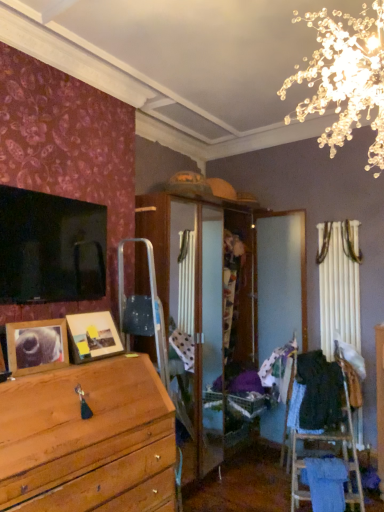
Question: Are patterned fabric at center, positioned as the first clothing in left-to-right order, and wooden picture frame at lower left, the 1th picture frame viewed from the front, making contact?

Choices:
 (A) no
 (B) yes

Answer: (A)

Question: Considering the relative sizes of patterned fabric at center, positioned as the first clothing in left-to-right order, and wooden picture frame at lower left, the 1th picture frame viewed from the front, in the image provided, is patterned fabric at center, positioned as the first clothing in left-to-right order, smaller than wooden picture frame at lower left, the 1th picture frame viewed from the front,?

Choices:
 (A) no
 (B) yes

Answer: (A)

Question: From the image's perspective, is patterned fabric at center, positioned as the first clothing in left-to-right order, over wooden picture frame at lower left, the 1th picture frame viewed from the front?

Choices:
 (A) no
 (B) yes

Answer: (A)

Question: Considering the relative sizes of patterned fabric at center, which is the 2th clothing in right-to-left order, and wooden picture frame at lower left, the 1th picture frame viewed from the front, in the image provided, is patterned fabric at center, which is the 2th clothing in right-to-left order, shorter than wooden picture frame at lower left, the 1th picture frame viewed from the front,?

Choices:
 (A) yes
 (B) no

Answer: (B)

Question: Does patterned fabric at center, which is the 2th clothing in right-to-left order, appear on the left side of wooden picture frame at lower left, arranged as the second picture frame when viewed from the back?

Choices:
 (A) yes
 (B) no

Answer: (B)

Question: Is point (264, 369) positioned closer to the camera than point (26, 368)?

Choices:
 (A) farther
 (B) closer

Answer: (A)

Question: From a real-world perspective, is patterned fabric at center, which is the 2th clothing in right-to-left order, above or below wooden picture frame at lower left, arranged as the second picture frame when viewed from the back?

Choices:
 (A) below
 (B) above

Answer: (A)

Question: Considering the positions of patterned fabric at center, positioned as the first clothing in left-to-right order, and wooden picture frame at lower left, arranged as the second picture frame when viewed from the back, in the image, is patterned fabric at center, positioned as the first clothing in left-to-right order, taller or shorter than wooden picture frame at lower left, arranged as the second picture frame when viewed from the back,?

Choices:
 (A) short
 (B) tall

Answer: (B)

Question: Is patterned fabric at center, which is the 2th clothing in right-to-left order, wider or thinner than wooden picture frame at lower left, arranged as the second picture frame when viewed from the back?

Choices:
 (A) wide
 (B) thin

Answer: (A)

Question: Do you think wooden photo frame at center, which is the first picture frame in back-to-front order, is within patterned fabric at center, which is the 2th clothing in right-to-left order, or outside of it?

Choices:
 (A) outside
 (B) inside

Answer: (A)

Question: In terms of size, does wooden photo frame at center, which is the first picture frame in back-to-front order, appear bigger or smaller than patterned fabric at center, positioned as the first clothing in left-to-right order?

Choices:
 (A) big
 (B) small

Answer: (A)

Question: From a real-world perspective, is wooden photo frame at center, acting as the 2th picture frame starting from the front, physically located above or below patterned fabric at center, positioned as the first clothing in left-to-right order?

Choices:
 (A) above
 (B) below

Answer: (A)

Question: Considering the positions of wooden photo frame at center, which is the first picture frame in back-to-front order, and patterned fabric at center, which is the 2th clothing in right-to-left order, in the image, is wooden photo frame at center, which is the first picture frame in back-to-front order, taller or shorter than patterned fabric at center, which is the 2th clothing in right-to-left order,?

Choices:
 (A) short
 (B) tall

Answer: (B)

Question: Based on their sizes in the image, would you say black fabric at right, which appears as the second clothing when viewed from the left, is bigger or smaller than patterned fabric at center, positioned as the first clothing in left-to-right order?

Choices:
 (A) big
 (B) small

Answer: (A)

Question: Does point (332, 380) appear closer or farther from the camera than point (289, 372)?

Choices:
 (A) closer
 (B) farther

Answer: (A)